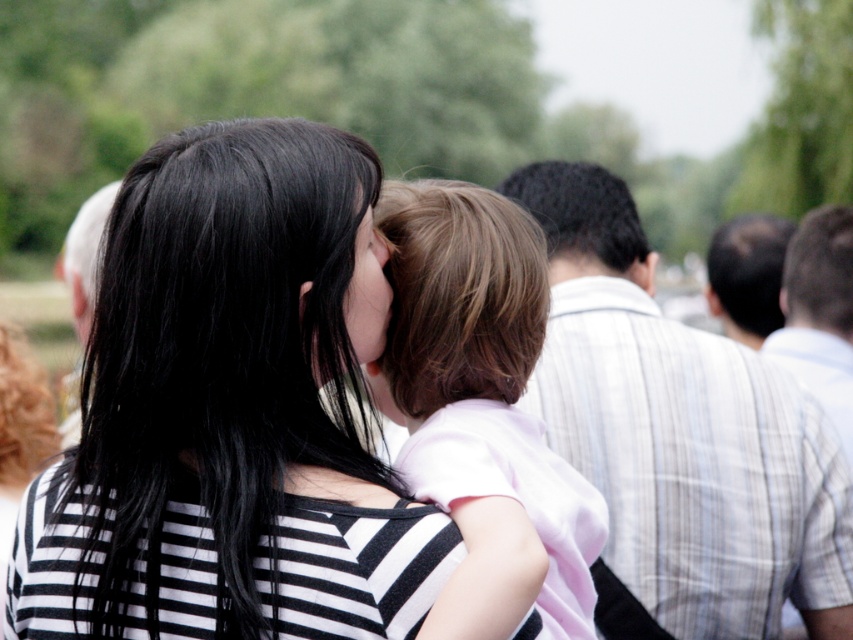
You are a photographer adjusting the camera settings for a portrait. You notice the black striped shirt at center and the striped shirt at right in the frame. Which object should you focus on if you want to ensure the wider one is in sharp focus?

The black striped shirt at center is wider than the striped shirt at right, so you should focus on the black striped shirt at center to ensure it is in sharp focus.

You are a photographer trying to capture a closeup of the black striped shirt at center without the striped shirt at right appearing in the background. Based on their positions, is this possible?

The black striped shirt at center is in front of the striped shirt at right, so it is possible to capture a closeup of the black striped shirt at center without the striped shirt at right appearing in the background by focusing on the foreground subject.